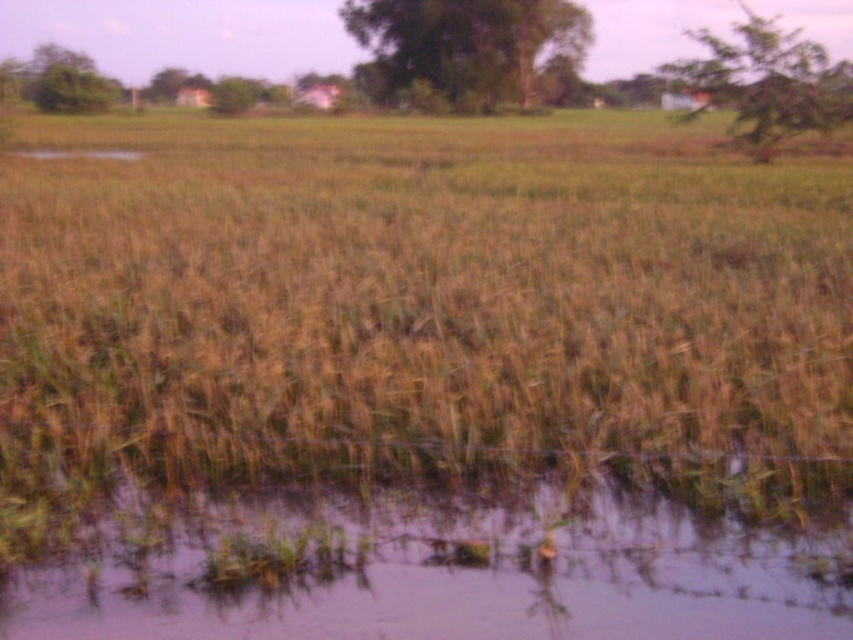
You are a farmer checking the flooded field. You notice the brown grass at center and the translucent muddy water at lower center. Which object is taller?

The brown grass at center is taller than the translucent muddy water at lower center.

You are standing at the edge of the flooded field and want to walk towards the brown grass at center. Will you step into the translucent muddy water at lower center before reaching it?

Yes, because the brown grass at center is closer to you than the translucent muddy water at lower center, so you would step into the water before reaching the grass.